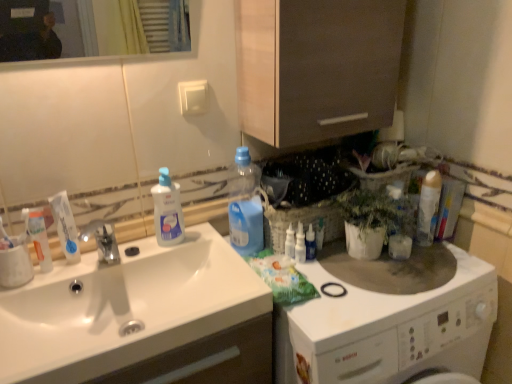
Question: Considering the relative sizes of white glossy sink at left and clear plastic bottle at sink, which ranks as the third cleaning product in right-to-left order, in the image provided, is white glossy sink at left bigger than clear plastic bottle at sink, which ranks as the third cleaning product in right-to-left order,?

Choices:
 (A) no
 (B) yes

Answer: (B)

Question: From the image's perspective, is white glossy sink at left on top of clear plastic bottle at sink, which ranks as the third cleaning product in right-to-left order?

Choices:
 (A) yes
 (B) no

Answer: (B)

Question: Is white glossy sink at left at the left side of clear plastic bottle at sink, which ranks as the third cleaning product in right-to-left order?

Choices:
 (A) yes
 (B) no

Answer: (A)

Question: From a real-world perspective, is white glossy sink at left positioned under clear plastic bottle at sink, which ranks as the third cleaning product in right-to-left order, based on gravity?

Choices:
 (A) yes
 (B) no

Answer: (A)

Question: From a real-world perspective, is white glossy sink at left over clear plastic bottle at sink, which appears as the first cleaning product when viewed from the left?

Choices:
 (A) yes
 (B) no

Answer: (B)

Question: Is clear plastic bottle at sink, which ranks as the third cleaning product in right-to-left order, at the back of white glossy sink at left?

Choices:
 (A) no
 (B) yes

Answer: (A)

Question: Can you confirm if translucent plastic spray bottle at upper right, arranged as the 2th toiletry when viewed from the front, is taller than white glossy washing machine at right?

Choices:
 (A) no
 (B) yes

Answer: (A)

Question: From the image's perspective, is translucent plastic spray bottle at upper right, which is counted as the 2th toiletry, starting from the right, below white glossy washing machine at right?

Choices:
 (A) no
 (B) yes

Answer: (A)

Question: Is white glossy washing machine at right inside translucent plastic spray bottle at upper right, arranged as the 2th toiletry when viewed from the front?

Choices:
 (A) no
 (B) yes

Answer: (A)

Question: Considering the relative sizes of translucent plastic spray bottle at upper right, which is counted as the 2th toiletry, starting from the right, and white glossy washing machine at right in the image provided, is translucent plastic spray bottle at upper right, which is counted as the 2th toiletry, starting from the right, bigger than white glossy washing machine at right?

Choices:
 (A) yes
 (B) no

Answer: (B)

Question: Considering the relative positions of translucent plastic spray bottle at upper right, marked as the 3th toiletry in a back-to-front arrangement, and white glossy washing machine at right in the image provided, is translucent plastic spray bottle at upper right, marked as the 3th toiletry in a back-to-front arrangement, to the left of white glossy washing machine at right from the viewer's perspective?

Choices:
 (A) no
 (B) yes

Answer: (B)

Question: Considering the relative sizes of translucent plastic spray bottle at upper right, positioned as the third toiletry in left-to-right order, and white glossy washing machine at right in the image provided, is translucent plastic spray bottle at upper right, positioned as the third toiletry in left-to-right order, smaller than white glossy washing machine at right?

Choices:
 (A) yes
 (B) no

Answer: (A)

Question: From a real-world perspective, is translucent plastic bottle at upper center, which is the 2th cleaning product from right to left, beneath clear plastic bottle at sink, which ranks as the third cleaning product in right-to-left order?

Choices:
 (A) no
 (B) yes

Answer: (B)